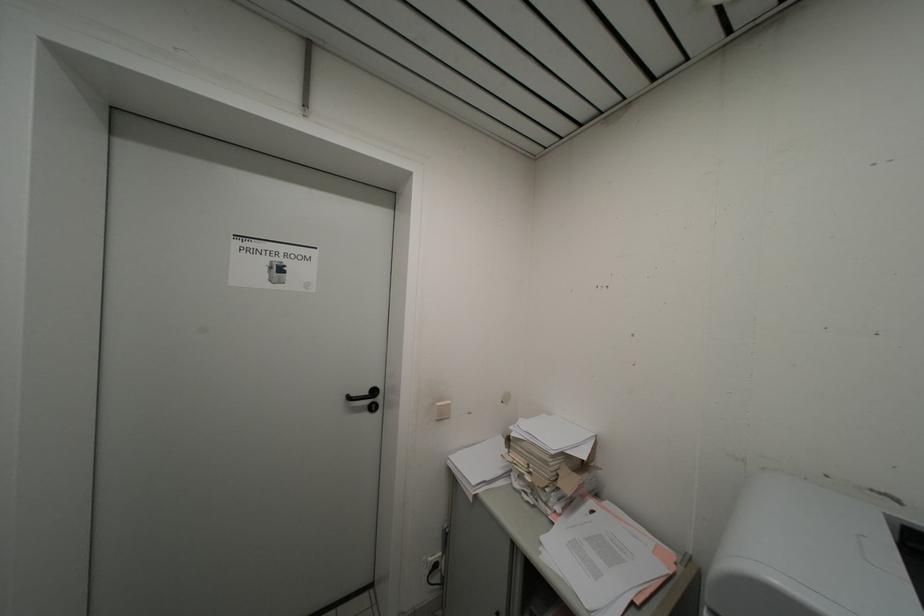
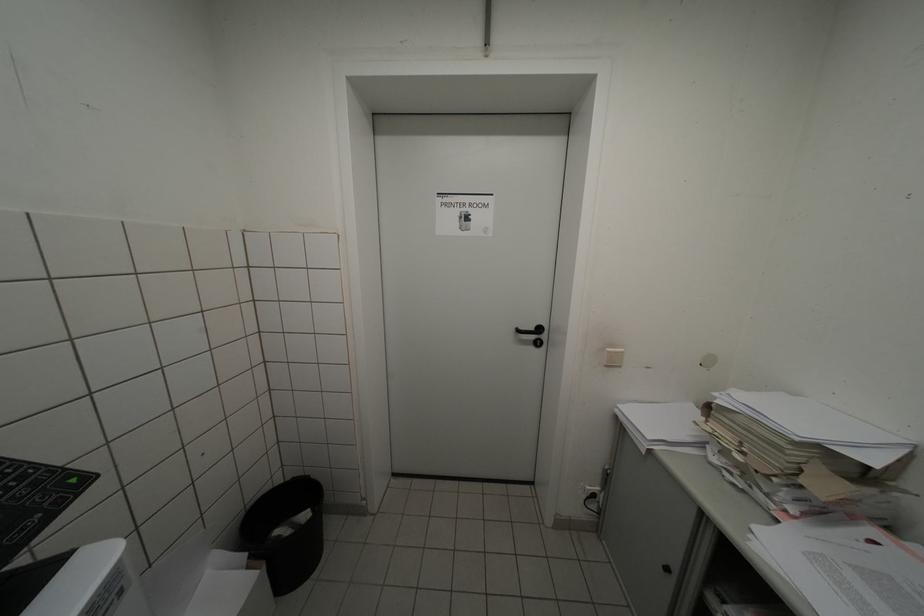
Locate, in the second image, the point that corresponds to (359,397) in the first image.

(529, 331)